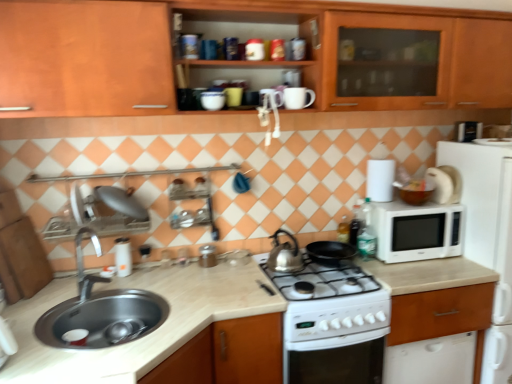
What are the coordinates of `free space above white marble countertop at lower left (from a real-world perspective)` in the screenshot? It's located at (135, 310).